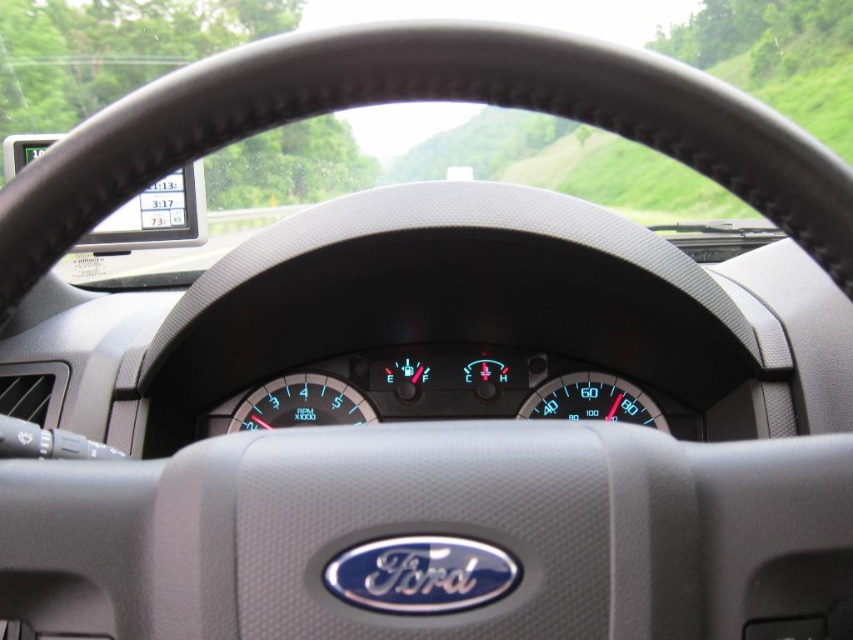
You are sitting in the driver seat of the Ford vehicle shown in the image. You want to reach the point marked as point (407, 90) on the dashboard. Your arm can extend 25 inches. Can you reach it?

The distance between point (407, 90) and the camera is 26.10 inches. Since your arm can only extend 25 inches, you cannot reach it.

You are a passenger in the Ford vehicle and want to check the speed. You see the transparent glass windshield at upper center and the blue digital display at center. Which object is closer to the driver?

The blue digital display at center is closer to the driver because the transparent glass windshield at upper center is to the right of it, meaning it is positioned further away from the driver.

You are a passenger in the car and want to check the speed using the instruments. Which object is located above the other between the transparent glass windshield at upper center and the blue digital display at center?

The transparent glass windshield at upper center is positioned over the blue digital display at center, so the transparent glass windshield at upper center is above the blue digital display at center.